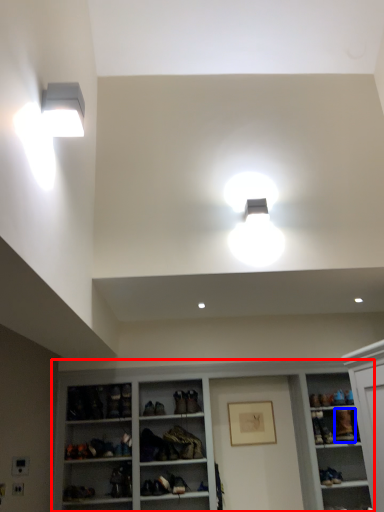
Question: Among these objects, which one is nearest to the camera, shelf (highlighted by a red box) or shoe (highlighted by a blue box)?

Choices:
 (A) shelf
 (B) shoe

Answer: (A)